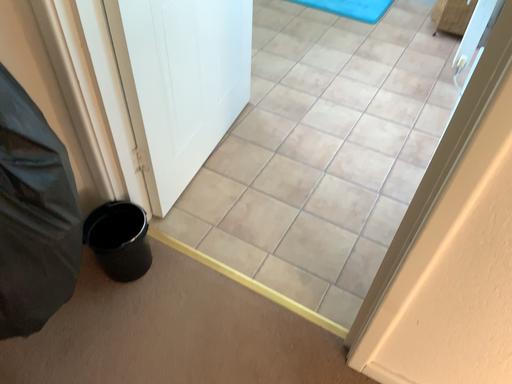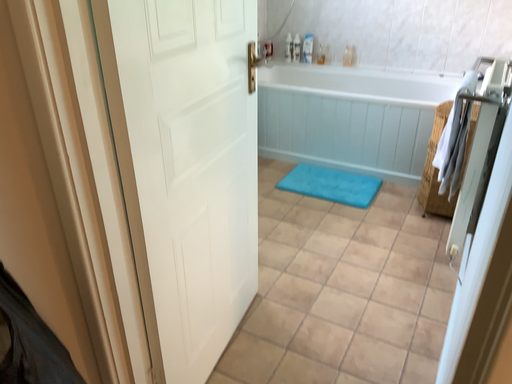
Question: Which way did the camera rotate in the video?

Choices:
 (A) rotated upward
 (B) rotated downward

Answer: (A)